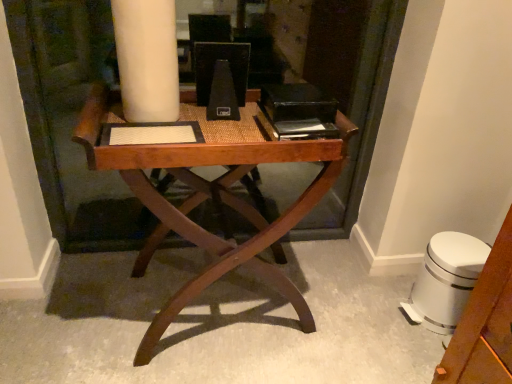
The height and width of the screenshot is (384, 512). I want to click on free space to the left of white plastic swivel chair at lower right, so click(374, 302).